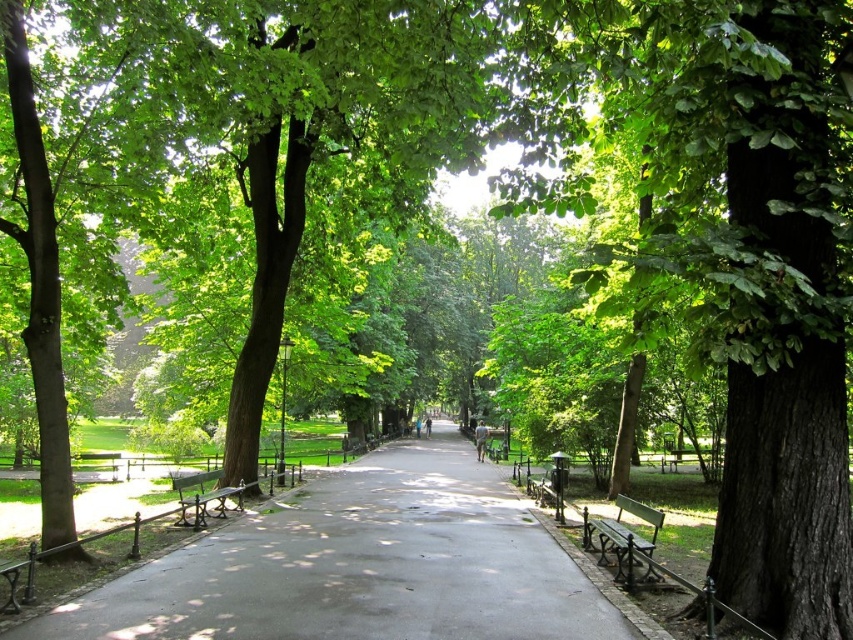
You are a park visitor who wants to sit down for a rest. You see the smooth asphalt path at center and the wooden bench at center. Which object is higher in elevation?

The smooth asphalt path at center is much taller than the wooden bench at center, so the smooth asphalt path at center is higher in elevation.

You are a park visitor who wants to sit on the wooden bench at center. However, there is a green wooden bench at right nearby. Which bench is located to the right of the other?

The green wooden bench at right is located to the right of the wooden bench at center.

You are a painter setting up your easel to capture the park scene. You need to choose between placing your easel on the wooden bench at center or the wooden park bench at center. Which bench is shorter in height so that you can comfortably paint without straining your neck?

The wooden bench at center is not as tall as the wooden park bench at center, so the wooden bench at center is shorter. Therefore, placing your easel on the wooden bench at center would be more comfortable for painting without straining your neck.